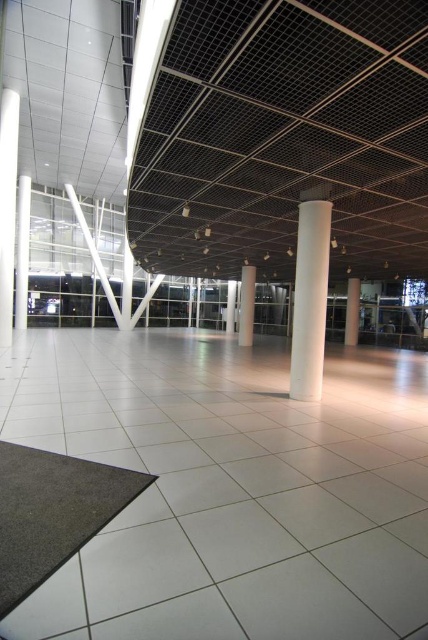
From the picture: Who is shorter, white glossy pillar at left or white smooth pillar at right?

Standing shorter between the two is white smooth pillar at right.

Is white glossy pillar at left to the left of white smooth pillar at right from the viewer's perspective?

Indeed, white glossy pillar at left is positioned on the left side of white smooth pillar at right.

You are a GUI agent. You are given a task and a screenshot of the screen. Output one action in this format:
    pyautogui.click(x=<x>, y=<y>)
    Task: Click on the white glossy pillar at left
    
    Given the screenshot: What is the action you would take?
    pyautogui.click(x=21, y=252)

Image resolution: width=428 pixels, height=640 pixels. In order to click on white glossy pillar at left in this screenshot , I will do `click(21, 252)`.

Does white smooth pillar at center have a greater width compared to white glossy pillar at center?

Correct, the width of white smooth pillar at center exceeds that of white glossy pillar at center.

Between white smooth pillar at center and white glossy pillar at center, which one has more height?

Standing taller between the two is white smooth pillar at center.

Who is more forward, (244, 342) or (226, 300)?

Positioned in front is point (244, 342).

Identify the location of white smooth pillar at center. (246, 305).

The image size is (428, 640). Describe the element at coordinates (53, 513) in the screenshot. I see `dark gray carpet at lower left` at that location.

Where is `dark gray carpet at lower left`? Image resolution: width=428 pixels, height=640 pixels. dark gray carpet at lower left is located at coordinates (53, 513).

Locate an element on the screen. Image resolution: width=428 pixels, height=640 pixels. dark gray carpet at lower left is located at coordinates (53, 513).